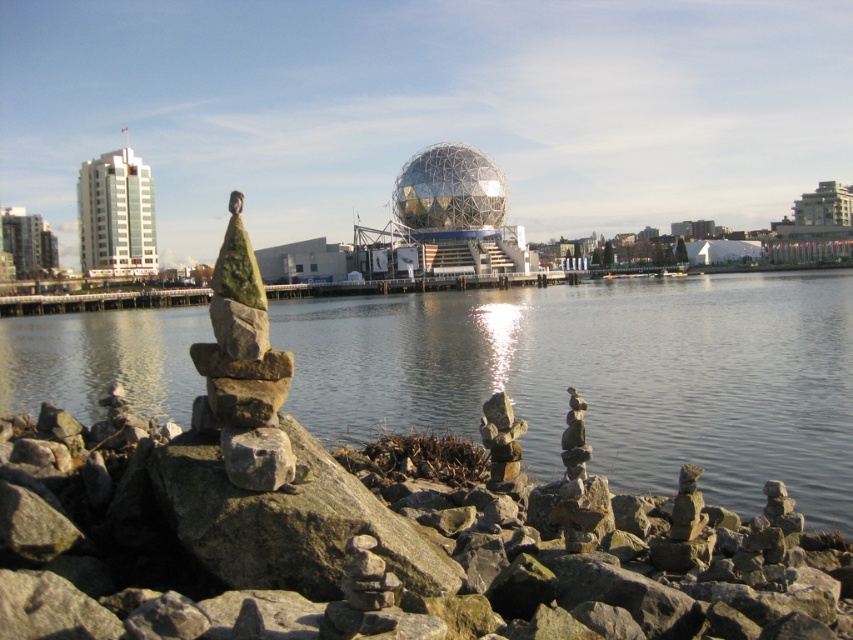
Question: Is clear water at center behind shiny metallic sphere at center?

Choices:
 (A) no
 (B) yes

Answer: (A)

Question: Can you confirm if smooth gray rock at center is wider than shiny metallic sphere at center?

Choices:
 (A) yes
 (B) no

Answer: (B)

Question: Is smooth gray rock at center thinner than clear water at center?

Choices:
 (A) no
 (B) yes

Answer: (B)

Question: Among these objects, which one is nearest to the camera?

Choices:
 (A) clear water at center
 (B) shiny metallic sphere at center

Answer: (A)

Question: Which point is farther to the camera?

Choices:
 (A) smooth gray rock at center
 (B) clear water at center

Answer: (B)

Question: Which point appears closest to the camera in this image?

Choices:
 (A) (114, 513)
 (B) (421, 180)
 (C) (843, 451)

Answer: (A)